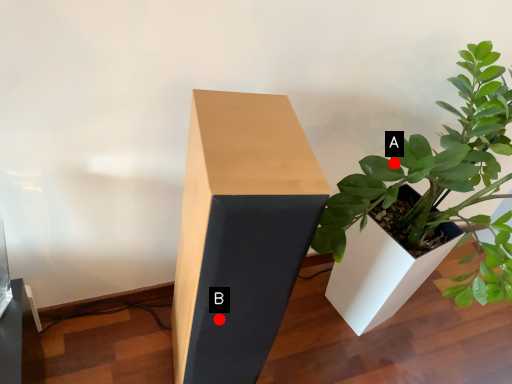
Question: Two points are circled on the image, labeled by A and B beside each circle. Which point appears closest to the camera in this image?

Choices:
 (A) A is closer
 (B) B is closer

Answer: (B)